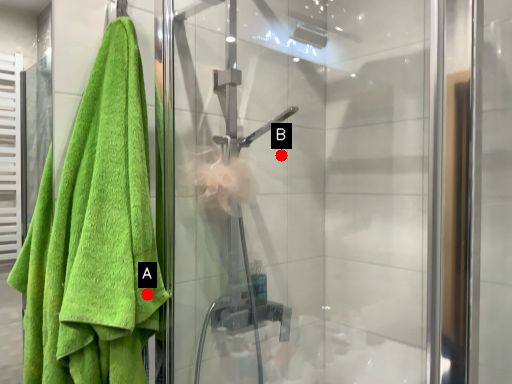
Question: Two points are circled on the image, labeled by A and B beside each circle. Which point is farther to the camera?

Choices:
 (A) A is further
 (B) B is further

Answer: (B)